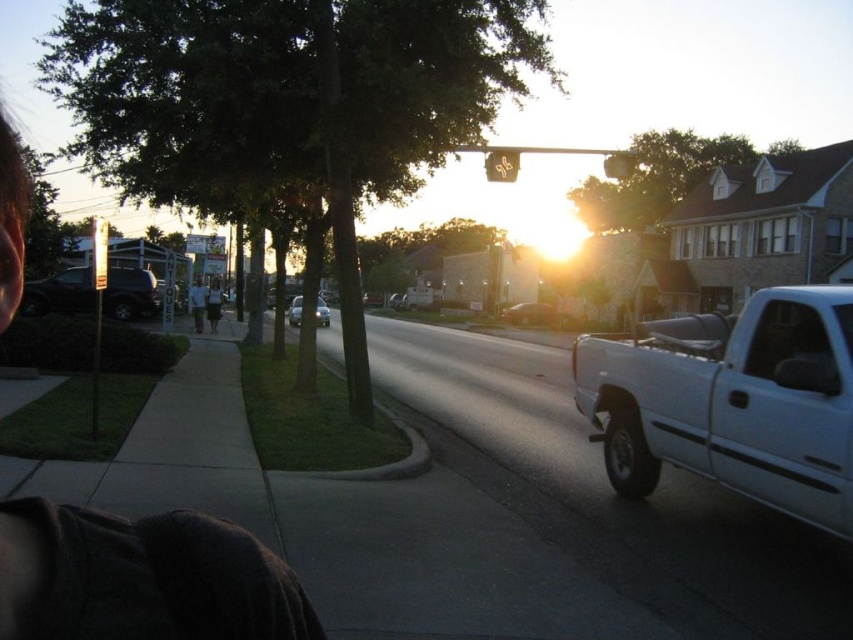
You are standing at the intersection and see two points marked on the road. The first point is at coordinates point (511, 317) and the second is at point (621, 172). Which point is closer to your current position?

Point (511, 317) is closer to your current position because it is further to the viewer than point (621, 172).

You are a pedestrian standing on the sidewalk and want to cross the street. The metallic silver sedan at center is blocking your view of the metallic yellow traffic light at upper center. Can you see the traffic light from your current position?

The metallic silver sedan at center occupies less space than metallic yellow traffic light at upper center, so you can see the traffic light from your current position.

You are a delivery driver who needs to park your matte black suv at left without hitting the metallic gold traffic light at upper center. Based on the scene, can you safely park your vehicle there?

The matte black suv at left is not as tall as the metallic gold traffic light at upper center, so it should be safe to park there without hitting the traffic light.